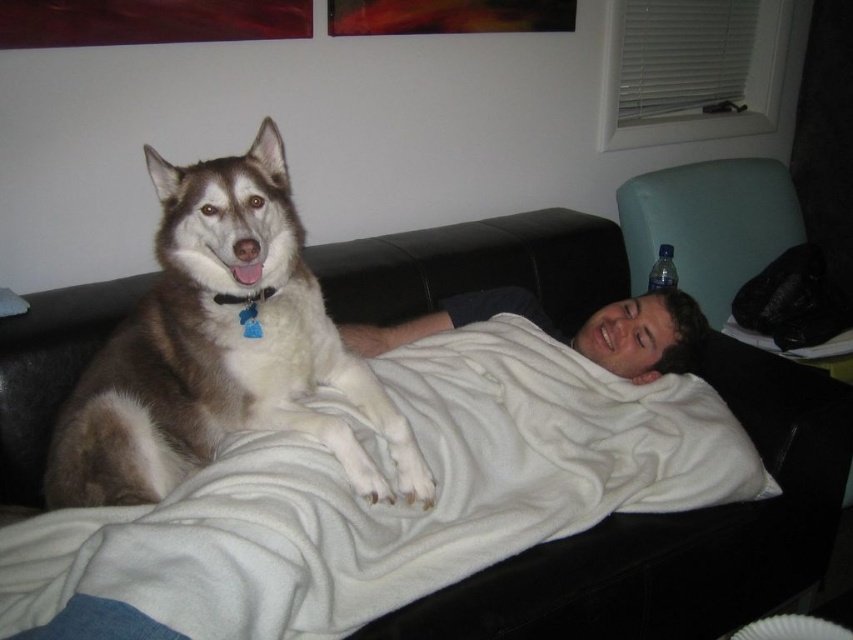
You are a delivery person who needs to place a small package between the white fleece blanket at center and the white soft blanket at center. Is there enough space for the package?

The distance between the white fleece blanket at center and the white soft blanket at center is 11.58 inches, so yes, there is enough space to place the small package between them.

You are a photographer setting up a shoot in this living room. You need to place a large tripod between the brown and white fur at center and the white soft blanket at center. Considering their sizes, which object should the tripod be closer to?

The brown and white fur at center is bigger than the white soft blanket at center, so the tripod should be placed closer to the brown and white fur at center to accommodate its larger size.

You are a delivery person who just arrived at the apartment. You see the white fleece blanket at center. Can you estimate its location in the room using coordinates?

The white fleece blanket at center is located at coordinates point (396, 500).